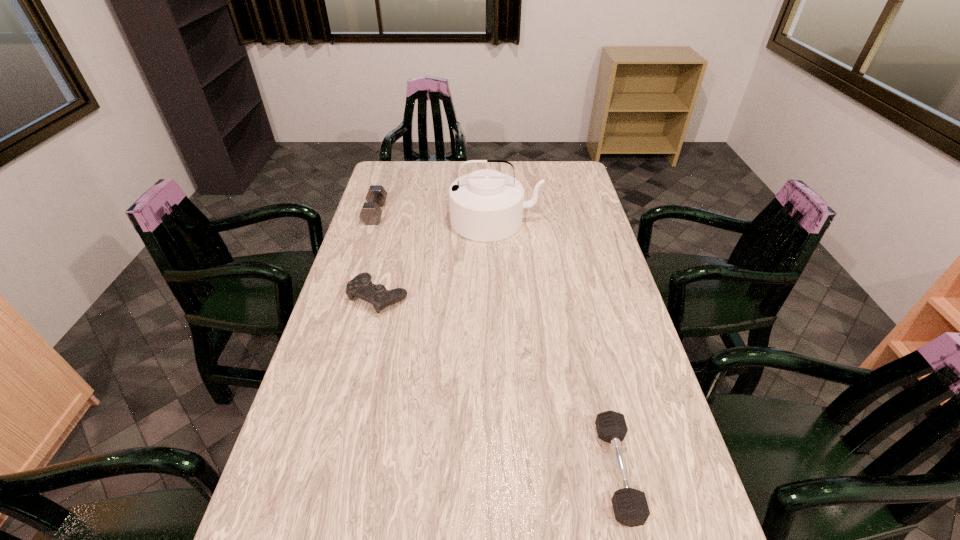
The height and width of the screenshot is (540, 960). In order to click on dumbbell situated at the left edge in this screenshot , I will do coord(371,212).

You are a GUI agent. You are given a task and a screenshot of the screen. Output one action in this format:
    pyautogui.click(x=<x>, y=<y>)
    Task: Click on the control that is at the left edge
    This screenshot has width=960, height=540.
    Given the screenshot: What is the action you would take?
    pyautogui.click(x=361, y=286)

The width and height of the screenshot is (960, 540). I want to click on object positioned at the right edge, so click(x=630, y=506).

In order to click on vacant space at the far edge of the desktop in this screenshot , I will do `click(539, 179)`.

Find the location of a particular element. blank area at the left edge is located at coordinates (390, 201).

At what (x,y) coordinates should I click in order to perform the action: click on vacant space at the right edge of the desktop. Please return your answer as a coordinate pair (x, y). Image resolution: width=960 pixels, height=540 pixels. Looking at the image, I should click on (597, 239).

I want to click on free space between the kettle and the left dumbbell, so coord(435,217).

Find the location of a particular element. free space that is in between the rightmost object and the kettle is located at coordinates (556, 346).

You are a GUI agent. You are given a task and a screenshot of the screen. Output one action in this format:
    pyautogui.click(x=<x>, y=<y>)
    Task: Click on the empty location between the left dumbbell and the kettle
    The width and height of the screenshot is (960, 540).
    Given the screenshot: What is the action you would take?
    pyautogui.click(x=435, y=217)

Identify the location of free space between the nearer dumbbell and the kettle. (556, 346).